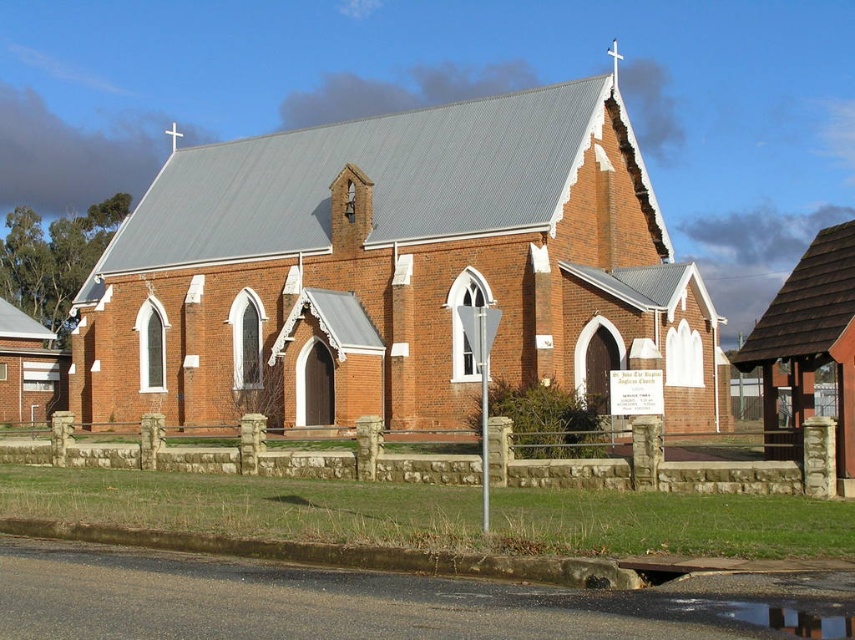
Does red brick church at center have a smaller size compared to glossy concrete puddle at lower center?

Actually, red brick church at center might be larger than glossy concrete puddle at lower center.

Who is more forward, (252, 212) or (697, 598)?

Point (697, 598)

Does point (205, 385) come in front of point (823, 616)?

No, (205, 385) is behind (823, 616).

Locate an element on the screen. The height and width of the screenshot is (640, 855). red brick church at center is located at coordinates (396, 273).